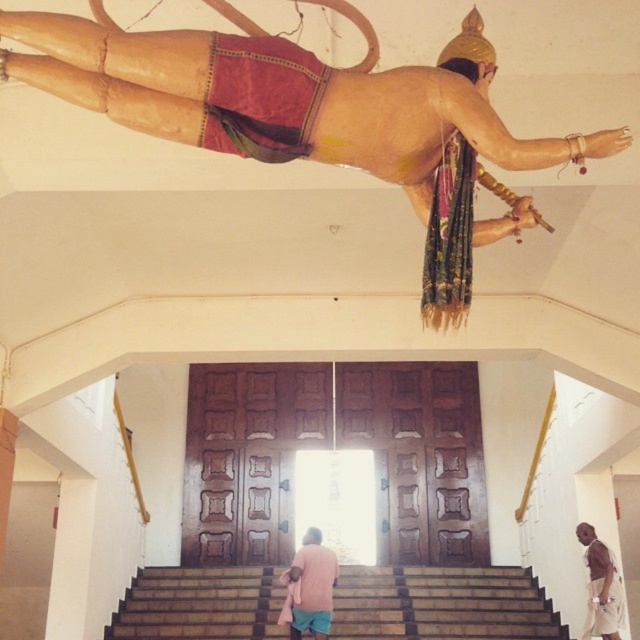
Is brown wooden stairs at center smaller than brown cotton shirt at lower right?

Indeed, brown wooden stairs at center has a smaller size compared to brown cotton shirt at lower right.

Is brown wooden stairs at center taller than brown cotton shirt at lower right?

In fact, brown wooden stairs at center may be shorter than brown cotton shirt at lower right.

Which is behind, point (362, 593) or point (586, 620)?

The point (362, 593) is more distant.

Where is `brown wooden stairs at center`? Image resolution: width=640 pixels, height=640 pixels. brown wooden stairs at center is located at coordinates (442, 604).

Does brown wooden stairs at center have a larger size compared to pink fabric at lower center?

Incorrect, brown wooden stairs at center is not larger than pink fabric at lower center.

Is brown wooden stairs at center in front of pink fabric at lower center?

No, brown wooden stairs at center is behind pink fabric at lower center.

Between point (180, 624) and point (305, 561), which one is positioned in front?

Point (305, 561) is more forward.

Locate an element on the screen. brown wooden stairs at center is located at coordinates (442, 604).

Is pink fabric at lower center below brown cotton shirt at lower right?

Yes, pink fabric at lower center is below brown cotton shirt at lower right.

Does pink fabric at lower center have a lesser width compared to brown cotton shirt at lower right?

Incorrect, pink fabric at lower center's width is not less than brown cotton shirt at lower right's.

Does point (314, 625) come farther from viewer compared to point (586, 557)?

That is True.

Identify the location of pink fabric at lower center. (310, 586).